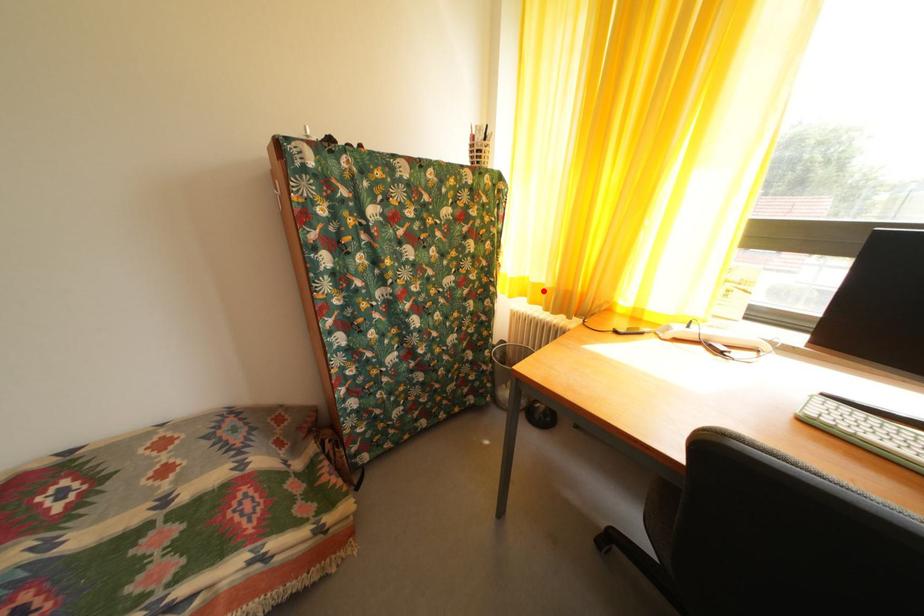
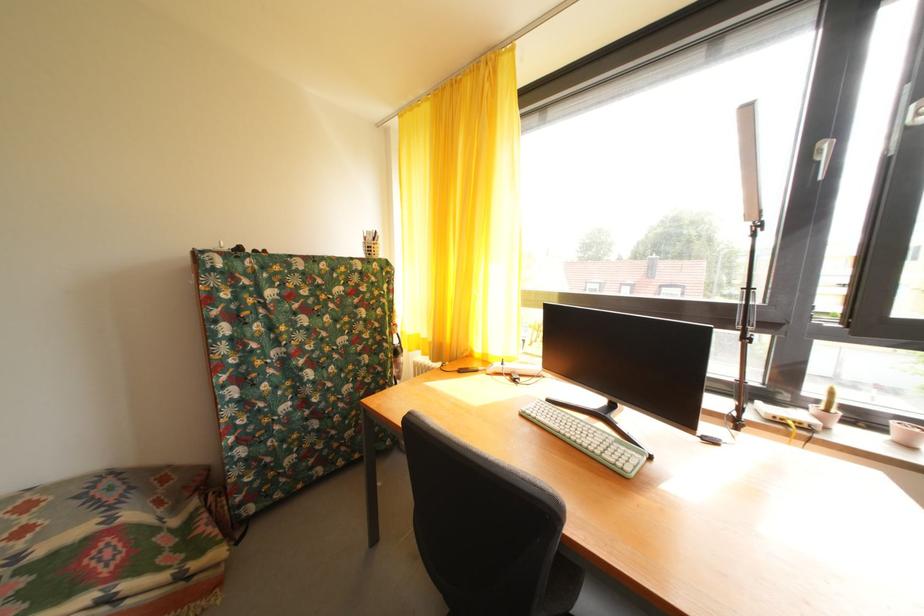
Question: A red point is marked in image1. In image2, is the corresponding 3D point closer to the camera or farther? Reply with the corresponding letter.

Choices:
 (A) The corresponding 3D point is closer.
 (B) The corresponding 3D point is farther.

Answer: (B)